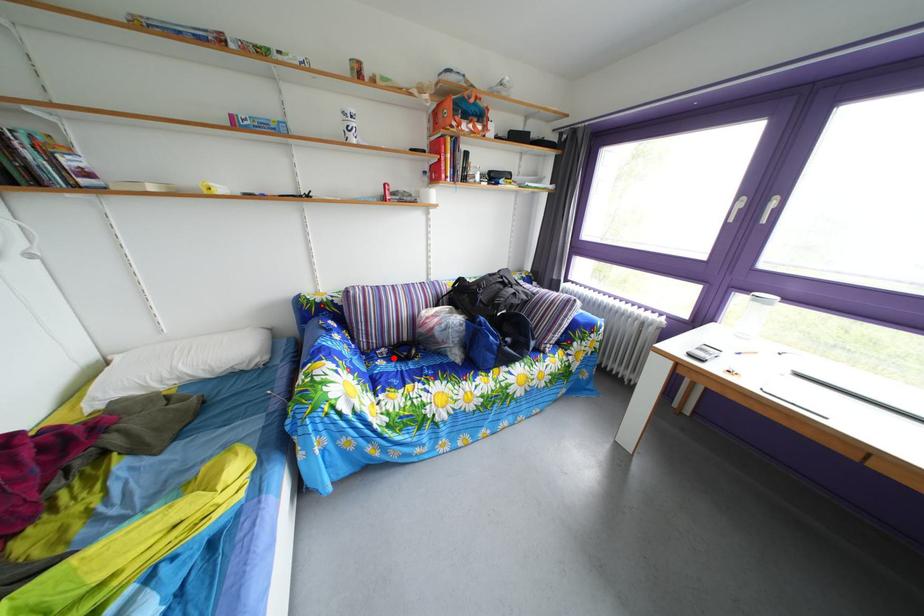
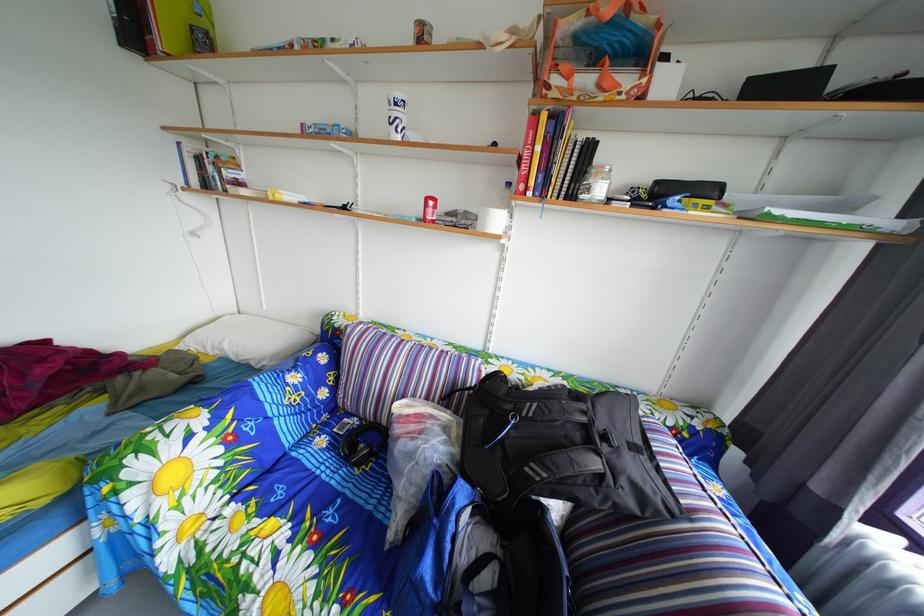
Question: I am providing you with two images of the same scene from different viewpoints. Image1 has a red point marked. In image2, the corresponding 3D location appears at what relative position? Reply with the corresponding letter.

Choices:
 (A) Closer
 (B) Farther

Answer: (B)